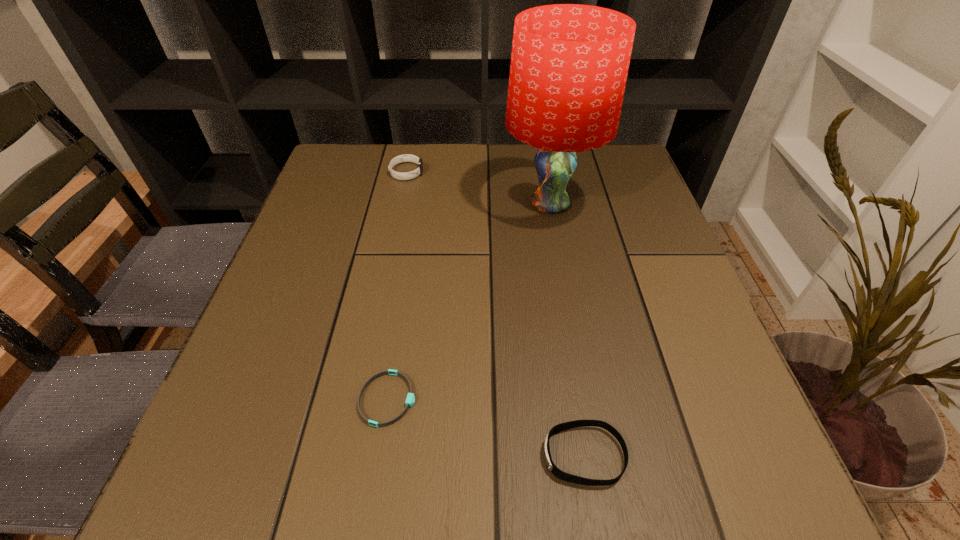
In order to click on blank space at the right edge in this screenshot , I will do `click(624, 203)`.

What are the coordinates of `free region at the far right corner` in the screenshot? It's located at (624, 151).

This screenshot has width=960, height=540. In order to click on vacant space that is in between the tallest wristband and the shortest wristband in this screenshot , I will do `click(396, 286)`.

In order to click on empty space between the lampshade and the tallest wristband in this screenshot , I will do `click(478, 188)`.

Where is `vacant area between the third shortest object and the shortest wristband`? vacant area between the third shortest object and the shortest wristband is located at coordinates (396, 286).

Find the location of a particular element. The height and width of the screenshot is (540, 960). unoccupied position between the shortest object and the lampshade is located at coordinates (468, 302).

This screenshot has width=960, height=540. I want to click on free spot between the third tallest object and the farthest wristband, so click(x=495, y=314).

In order to click on free area in between the second tallest wristband and the second tallest object in this screenshot , I will do `click(495, 314)`.

What are the coordinates of `free area in between the third shortest object and the tallest object` in the screenshot? It's located at (478, 188).

The image size is (960, 540). Find the location of `vacant area that lies between the second shortest object and the farthest wristband`. vacant area that lies between the second shortest object and the farthest wristband is located at coordinates pyautogui.click(x=495, y=314).